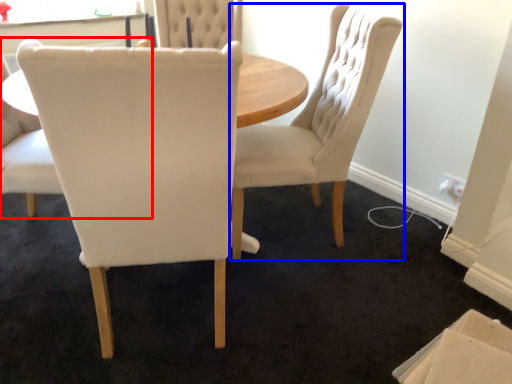
Question: Which object is closer to the camera taking this photo, chair (highlighted by a red box) or chair (highlighted by a blue box)?

Choices:
 (A) chair
 (B) chair

Answer: (A)